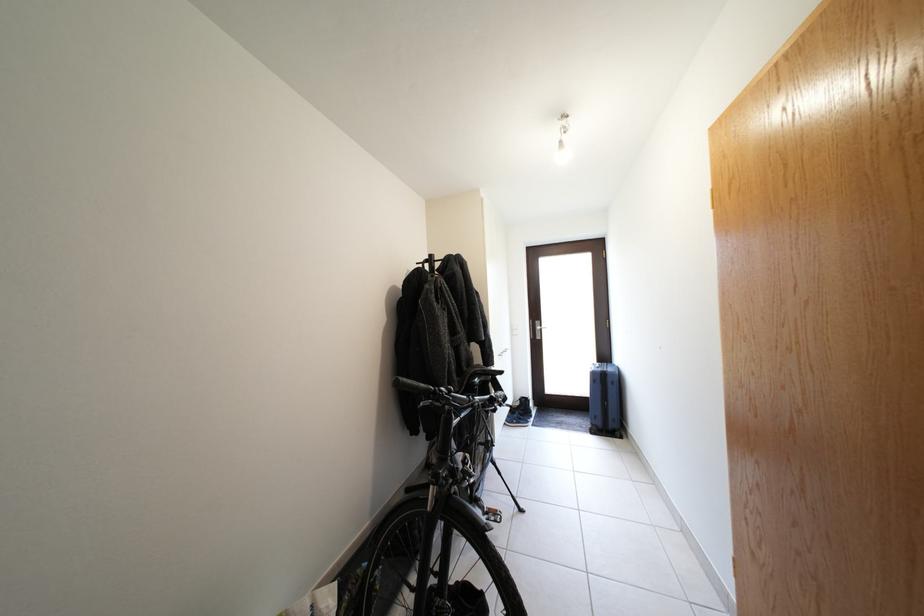
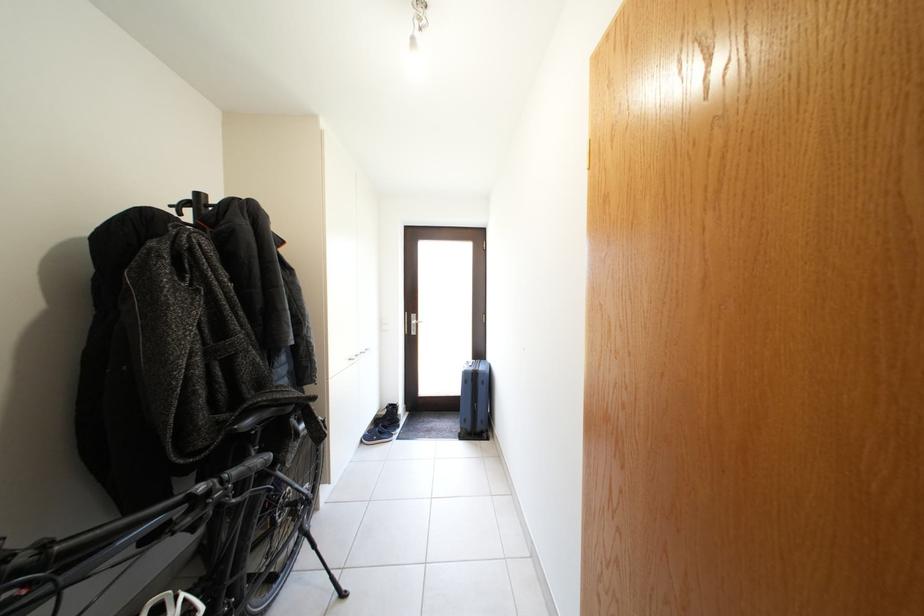
Where in the second image is the point corresponding to [528,419] from the first image?

(392, 431)